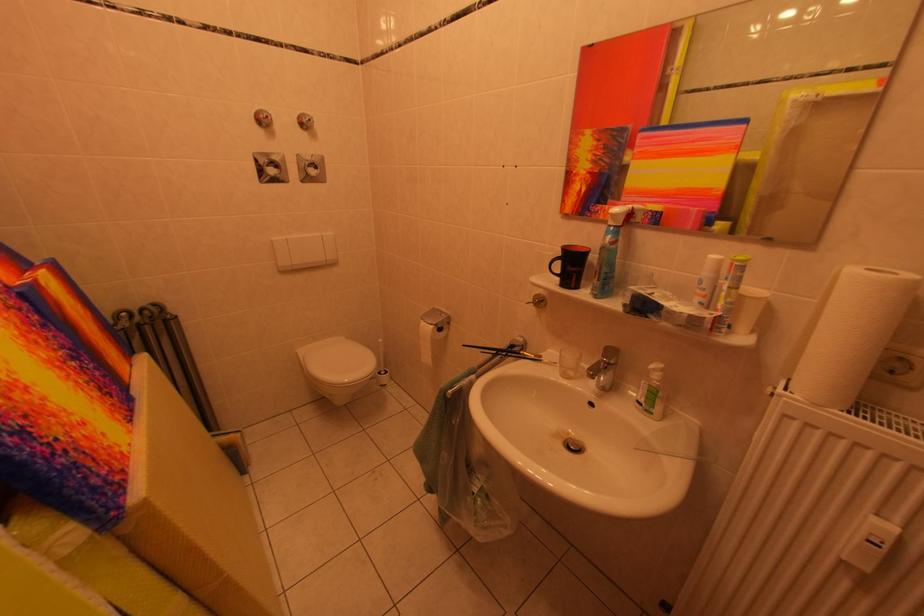
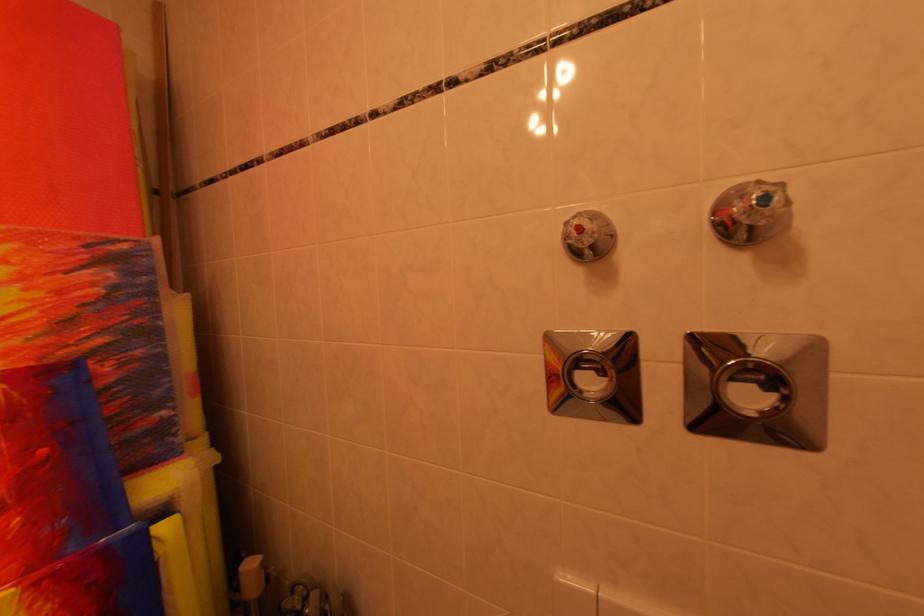
Find the pixel in the second image that matches [332,161] in the first image.

(824, 351)